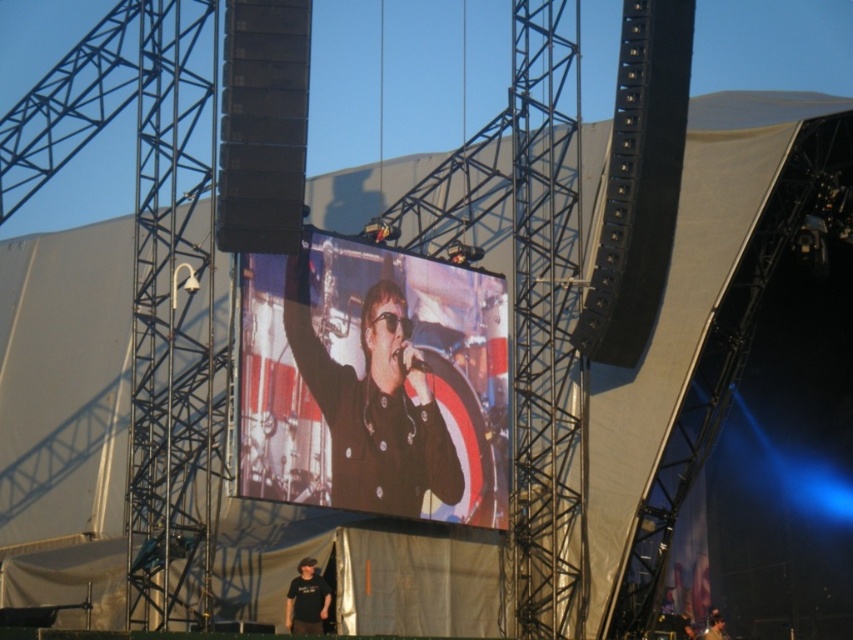
Question: Which point appears farthest from the camera in this image?

Choices:
 (A) (347, 396)
 (B) (291, 595)

Answer: (B)

Question: Does black matte jacket at center have a smaller size compared to black matte shirt at lower center?

Choices:
 (A) no
 (B) yes

Answer: (A)

Question: Among these points, which one is nearest to the camera?

Choices:
 (A) (352, 497)
 (B) (303, 589)

Answer: (A)

Question: Does black matte jacket at center appear on the left side of black matte shirt at lower center?

Choices:
 (A) yes
 (B) no

Answer: (B)

Question: Can you confirm if black matte jacket at center is bigger than black matte shirt at lower center?

Choices:
 (A) yes
 (B) no

Answer: (A)